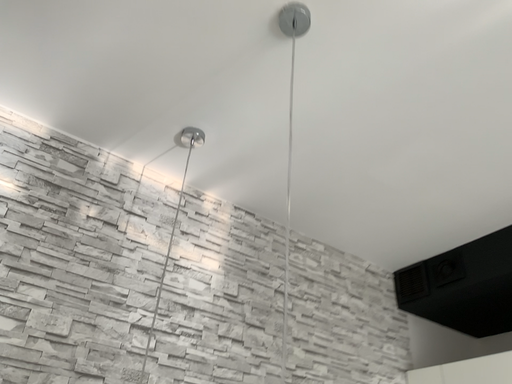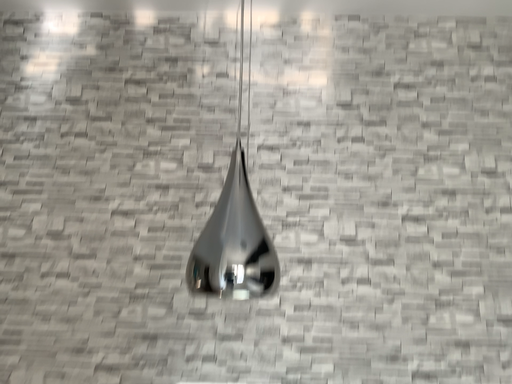
Question: How did the camera likely rotate when shooting the video?

Choices:
 (A) rotated downward
 (B) rotated upward

Answer: (A)